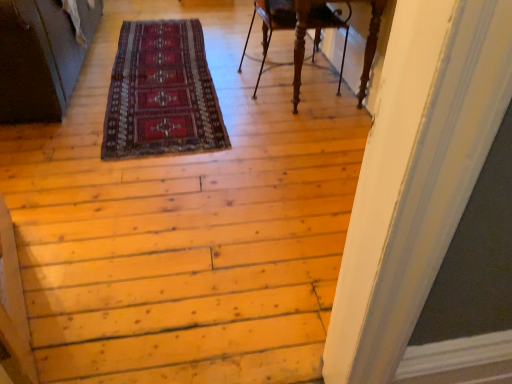
Where is `vacant space in front of red woolen rug at center`? This screenshot has height=384, width=512. vacant space in front of red woolen rug at center is located at coordinates (161, 190).